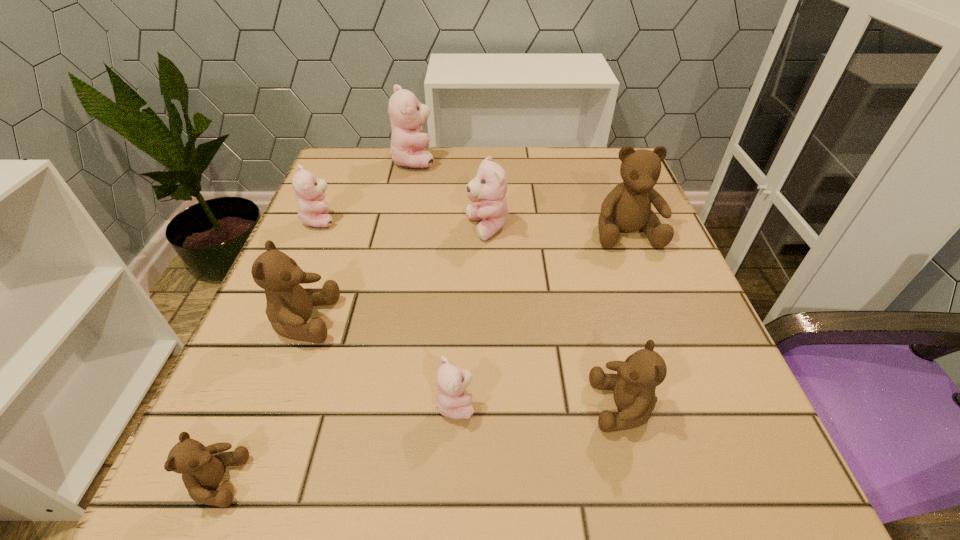
What are the coordinates of `the nearest brown teddy bear` in the screenshot? It's located at (202, 468).

I want to click on vacant area situated 0.390m at the face of the fourth teddy bear from left to right, so click(x=588, y=160).

Identify the location of vacant space located on the front-facing side of the farthest brown teddy bear. (692, 404).

Where is `free region located at the face of the second biggest pink teddy bear`? This screenshot has width=960, height=540. free region located at the face of the second biggest pink teddy bear is located at coordinates (432, 228).

In order to click on blank space located 0.330m at the face of the second biggest pink teddy bear in this screenshot , I will do `click(307, 228)`.

The width and height of the screenshot is (960, 540). I want to click on vacant space located 0.130m at the face of the second biggest pink teddy bear, so click(403, 228).

Find the location of a particular element. Image resolution: width=960 pixels, height=540 pixels. vacant space located on the front-facing side of the fourth nearest object is located at coordinates (366, 321).

The width and height of the screenshot is (960, 540). I want to click on free space located at the face of the third biggest pink teddy bear, so click(x=389, y=220).

Find the location of a particular element. This screenshot has height=540, width=960. free space located on the front-facing side of the second nearest brown teddy bear is located at coordinates (373, 406).

I want to click on vacant space situated on the front-facing side of the second nearest brown teddy bear, so click(422, 406).